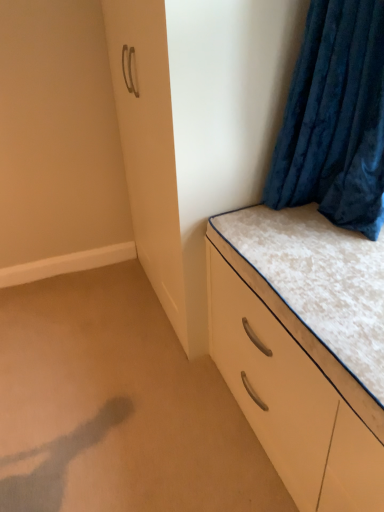
The width and height of the screenshot is (384, 512). What are the coordinates of `empty space that is ontop of beige carpet at lower left` in the screenshot? It's located at (112, 381).